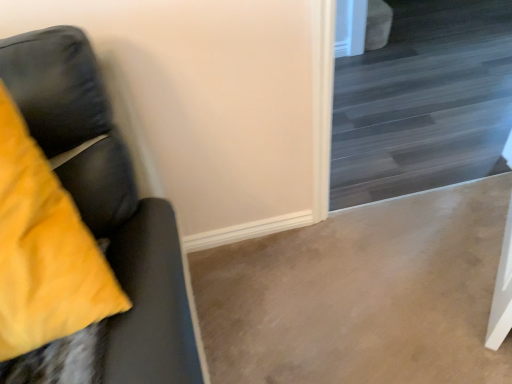
Question: Considering the positions of matte black couch at left and dark wood stairs at upper right in the image, is matte black couch at left wider or thinner than dark wood stairs at upper right?

Choices:
 (A) wide
 (B) thin

Answer: (A)

Question: Considering the positions of matte black couch at left and dark wood stairs at upper right in the image, is matte black couch at left bigger or smaller than dark wood stairs at upper right?

Choices:
 (A) big
 (B) small

Answer: (B)

Question: Is point (106, 336) closer or farther from the camera than point (455, 162)?

Choices:
 (A) closer
 (B) farther

Answer: (A)

Question: Considering their positions, is dark wood stairs at upper right located in front of or behind matte black couch at left?

Choices:
 (A) behind
 (B) front

Answer: (A)

Question: Is dark wood stairs at upper right situated inside matte black couch at left or outside?

Choices:
 (A) outside
 (B) inside

Answer: (A)

Question: In terms of width, does dark wood stairs at upper right look wider or thinner when compared to matte black couch at left?

Choices:
 (A) thin
 (B) wide

Answer: (A)

Question: From their relative heights in the image, would you say dark wood stairs at upper right is taller or shorter than matte black couch at left?

Choices:
 (A) tall
 (B) short

Answer: (A)